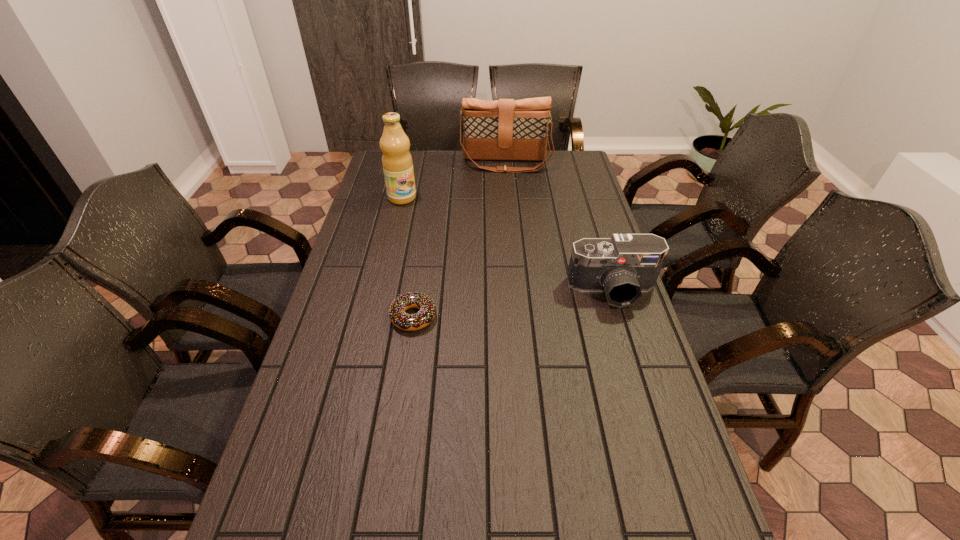
Identify the location of empty space between the olive oil and the second shortest object. The width and height of the screenshot is (960, 540). (508, 244).

The width and height of the screenshot is (960, 540). Identify the location of empty space that is in between the shortest object and the farthest object. (460, 240).

At what (x,y) coordinates should I click in order to perform the action: click on vacant region between the camera and the second farthest object. Please return your answer as a coordinate pair (x, y). Image resolution: width=960 pixels, height=540 pixels. Looking at the image, I should click on tap(508, 244).

Select which object is the third closest to the farthest object. Please provide its 2D coordinates. Your answer should be formatted as a tuple, i.e. [(x, y)], where the tuple contains the x and y coordinates of a point satisfying the conditions above.

[(402, 320)]

Image resolution: width=960 pixels, height=540 pixels. I want to click on object that ranks as the third closest to the third tallest object, so click(x=397, y=163).

Identify the location of free space that satisfies the following two spatial constraints: 1. on the back side of the farthest object; 2. on the left side of the doughnut. (436, 163).